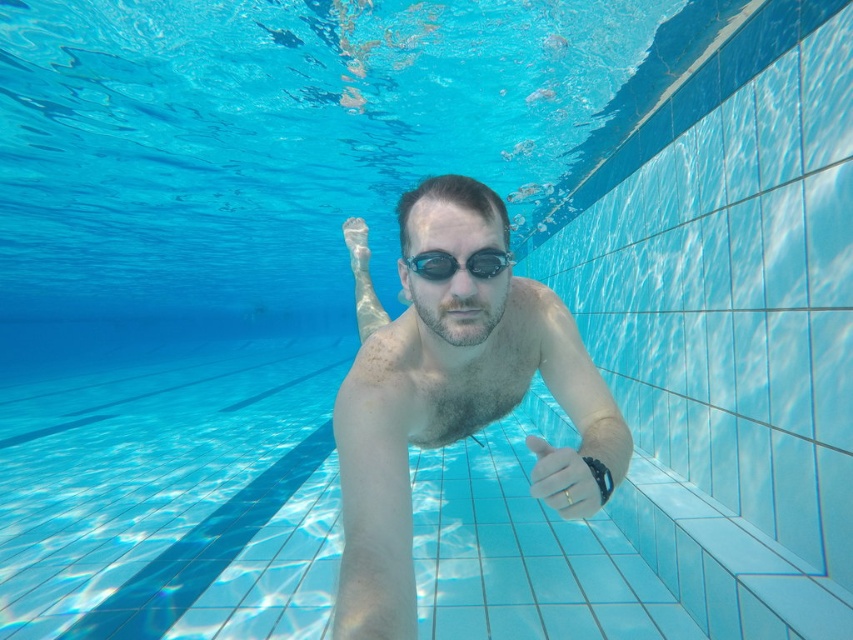
You are a swimmer trying to touch your watch on your left wrist while looking at your transparent rubber goggles at center. Given the distance between your white matte hand at center and the goggles, can you reach your watch without moving your hand?

The distance between the white matte hand at center and transparent rubber goggles at center is 15.39 inches. Since the watch is on your left wrist and your hand is at center, you would need to move your hand to reach it, so you cannot touch the watch without moving your hand.

You are a lifeguard trying to assess the safety of a swimmer in the pool. You notice the white matte hand at center and the transparent rubber goggles at center. Which object is wider?

The white matte hand at center is wider than the transparent rubber goggles at center according to the description.

You are a swimmer looking at the pool from the bottom. You see the smooth skin man at center and the white matte hand at center. Which object is closer to you?

The smooth skin man at center is closer to you because he is further to the viewer than the white matte hand at center.